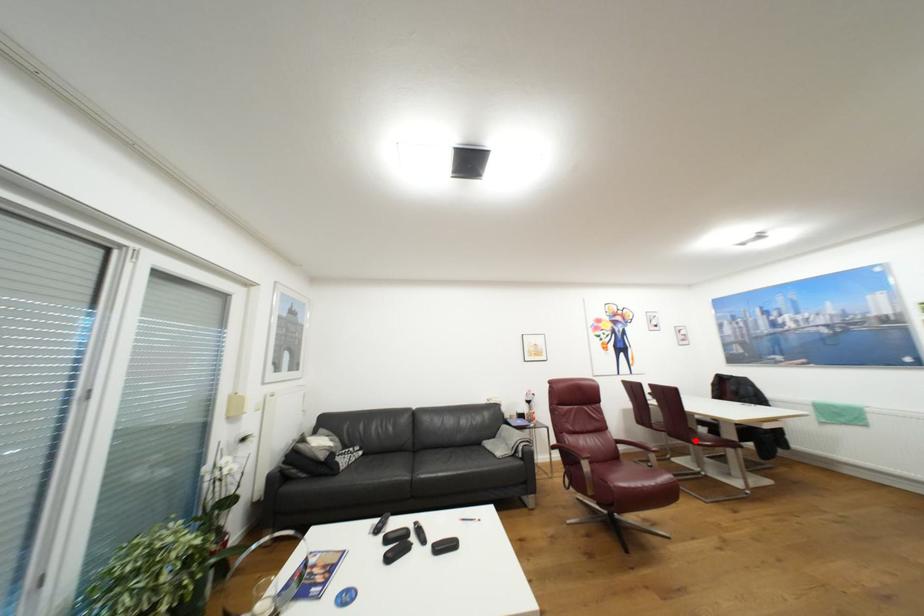
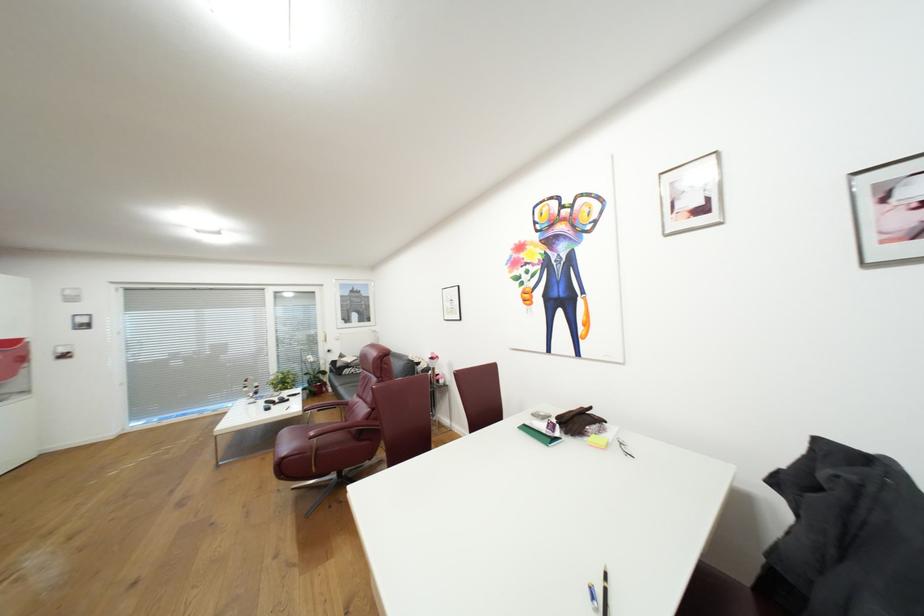
Question: I am providing you with two images of the same scene from different viewpoints. A red point is marked on the first image. Can you still see the location of the red point in image 2?

Choices:
 (A) Yes
 (B) No

Answer: (B)